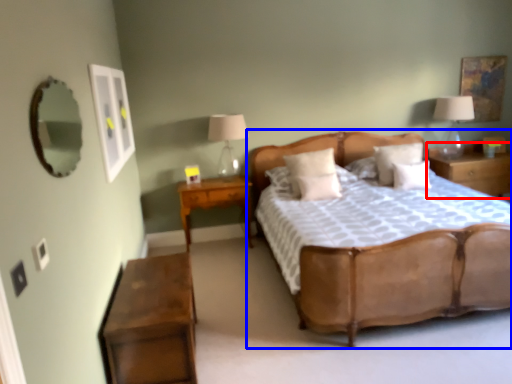
Question: Which of the following is the closest to the observer, nightstand (highlighted by a red box) or bed (highlighted by a blue box)?

Choices:
 (A) nightstand
 (B) bed

Answer: (B)